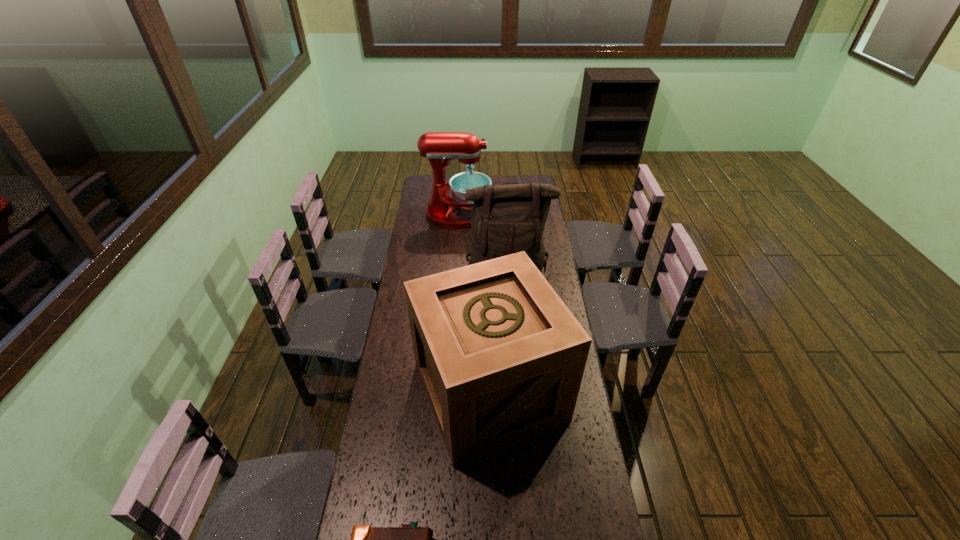
This screenshot has height=540, width=960. Find the location of `backpack`. backpack is located at coordinates coord(506,219).

Identify the location of the farthest object. This screenshot has height=540, width=960. 440,148.

I want to click on box, so click(501, 358).

Locate an element on the screen. The height and width of the screenshot is (540, 960). vacant region located 0.160m on the open flap of the backpack is located at coordinates tap(511, 319).

Locate an element on the screen. This screenshot has height=540, width=960. free space located 0.110m on the front-facing side of the mixer is located at coordinates (511, 214).

You are a GUI agent. You are given a task and a screenshot of the screen. Output one action in this format:
    pyautogui.click(x=<x>, y=<y>)
    Task: Click on the vacant space located on the front of the second nearest object
    
    Given the screenshot: What is the action you would take?
    click(492, 487)

Where is `mixer located at the left edge`? This screenshot has height=540, width=960. mixer located at the left edge is located at coordinates (440, 148).

Find the location of a particular element. box located in the left edge section of the desktop is located at coordinates (501, 358).

Locate an element on the screen. Image resolution: width=960 pixels, height=540 pixels. backpack at the right edge is located at coordinates (506, 219).

At what (x,y) coordinates should I click in order to perform the action: click on box at the right edge. Please return your answer as a coordinate pair (x, y). This screenshot has width=960, height=540. Looking at the image, I should click on (501, 358).